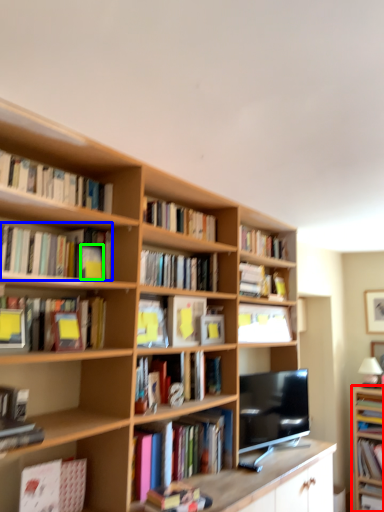
Question: Which is farther away from bookcase (highlighted by a red box)? book (highlighted by a blue box) or paperback book (highlighted by a green box)?

Choices:
 (A) book
 (B) paperback book

Answer: (A)